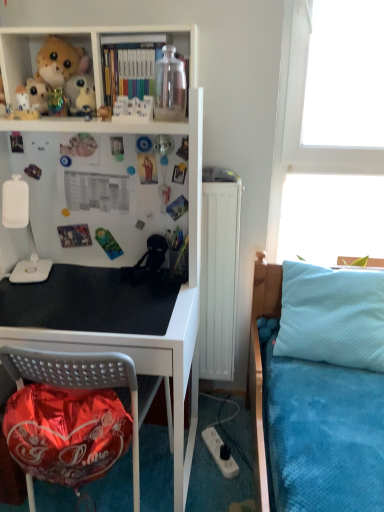
Question: Considering the relative sizes of white plush toy at upper left, which ranks as the third toy in front-to-back order, and white plastic power outlet at lower center in the image provided, is white plush toy at upper left, which ranks as the third toy in front-to-back order, taller than white plastic power outlet at lower center?

Choices:
 (A) yes
 (B) no

Answer: (A)

Question: Can you confirm if white plush toy at upper left, which appears as the 3th toy when viewed from the right, is thinner than white plastic power outlet at lower center?

Choices:
 (A) yes
 (B) no

Answer: (A)

Question: Can you confirm if white plush toy at upper left, which ranks as the third toy in front-to-back order, is smaller than white plastic power outlet at lower center?

Choices:
 (A) no
 (B) yes

Answer: (A)

Question: From a real-world perspective, is white plush toy at upper left, acting as the 1th toy starting from the back, on white plastic power outlet at lower center?

Choices:
 (A) yes
 (B) no

Answer: (A)

Question: Can you confirm if white plush toy at upper left, acting as the 1th toy starting from the back, is shorter than white plastic power outlet at lower center?

Choices:
 (A) yes
 (B) no

Answer: (B)

Question: Is white plush toy at upper left, acting as the 1th toy starting from the back, behind white plastic power outlet at lower center?

Choices:
 (A) yes
 (B) no

Answer: (B)

Question: Is white plush toy at upper left, which appears as the 3th toy when viewed from the right, positioned far away from white plastic lamp at left?

Choices:
 (A) yes
 (B) no

Answer: (B)

Question: From the image's perspective, is white plush toy at upper left, acting as the 1th toy starting from the back, located above white plastic lamp at left?

Choices:
 (A) no
 (B) yes

Answer: (B)

Question: Does white plush toy at upper left, which ranks as the third toy in front-to-back order, have a lesser width compared to white plastic lamp at left?

Choices:
 (A) yes
 (B) no

Answer: (A)

Question: From a real-world perspective, is white plush toy at upper left, which appears as the 3th toy when viewed from the right, beneath white plastic lamp at left?

Choices:
 (A) no
 (B) yes

Answer: (A)

Question: Is white plush toy at upper left, which ranks as the third toy in front-to-back order, wider than white plastic lamp at left?

Choices:
 (A) yes
 (B) no

Answer: (B)

Question: Considering the relative sizes of white plush toy at upper left, which ranks as the third toy in front-to-back order, and white plastic lamp at left in the image provided, is white plush toy at upper left, which ranks as the third toy in front-to-back order, smaller than white plastic lamp at left?

Choices:
 (A) yes
 (B) no

Answer: (A)

Question: Is matte plastic books at upper center not inside transparent glass jar at upper center?

Choices:
 (A) yes
 (B) no

Answer: (A)